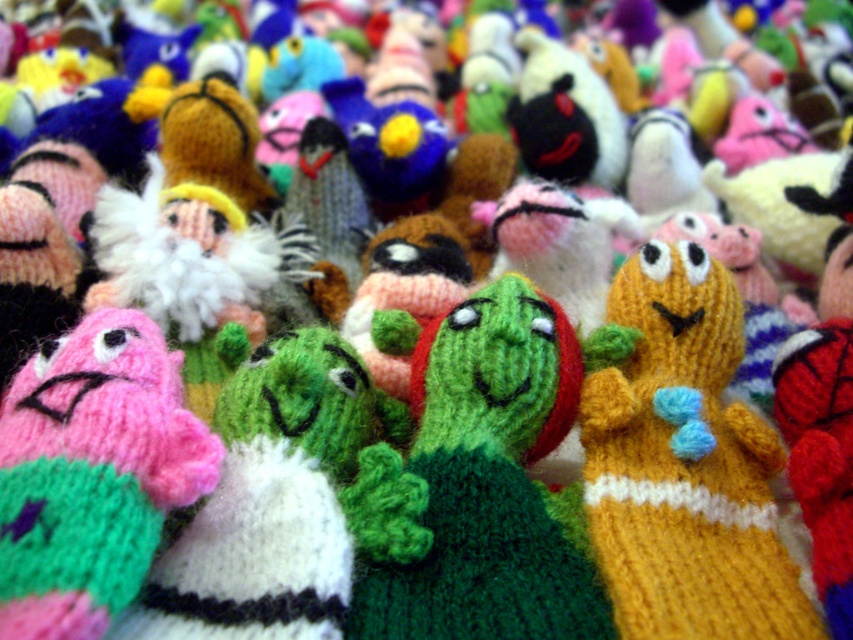
Is point (520, 372) farther from viewer compared to point (735, 369)?

No.

Which is above, green knitted toy at center or yellow knitted toy at center-right?

green knitted toy at center is higher up.

The height and width of the screenshot is (640, 853). I want to click on green knitted toy at center, so click(479, 480).

You are a GUI agent. You are given a task and a screenshot of the screen. Output one action in this format:
    pyautogui.click(x=<x>, y=<y>)
    Task: Click on the green knitted toy at center
    
    Given the screenshot: What is the action you would take?
    pyautogui.click(x=479, y=480)

From the picture: Can you confirm if yellow knitted toy at center-right is shorter than pink knitted toy at left?

No.

At what (x,y) coordinates should I click in order to perform the action: click on yellow knitted toy at center-right. Please return your answer as a coordinate pair (x, y). Looking at the image, I should click on (685, 467).

Image resolution: width=853 pixels, height=640 pixels. Find the location of `yellow knitted toy at center-right`. yellow knitted toy at center-right is located at coordinates (685, 467).

Does green knitted toy at center appear on the right side of pink knitted toy at left?

Yes, green knitted toy at center is to the right of pink knitted toy at left.

Is green knitted toy at center further to camera compared to pink knitted toy at left?

Yes, green knitted toy at center is behind pink knitted toy at left.

The image size is (853, 640). Identify the location of green knitted toy at center. (479, 480).